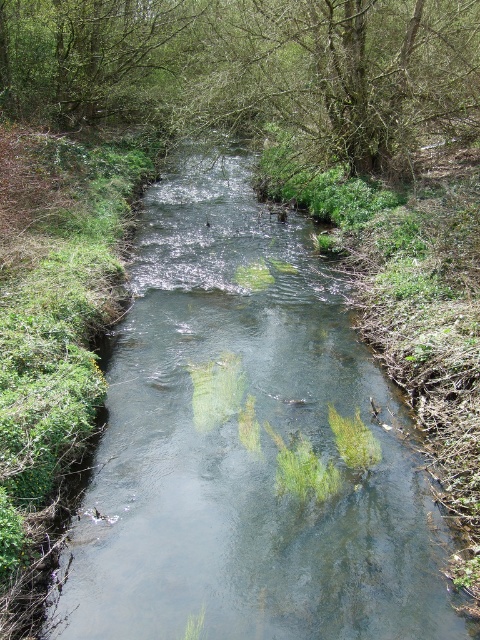
Question: Does green leafy tree at center have a greater width compared to green leafy tree at upper left?

Choices:
 (A) no
 (B) yes

Answer: (B)

Question: Estimate the real-world distances between objects in this image. Which object is farther from the green leafy tree at upper left?

Choices:
 (A) green leafy tree at center
 (B) clear water stream at center

Answer: (B)

Question: Which point is farther to the camera?

Choices:
 (A) clear water stream at center
 (B) green leafy tree at center

Answer: (B)

Question: Does clear water stream at center appear over green leafy tree at center?

Choices:
 (A) no
 (B) yes

Answer: (A)

Question: Estimate the real-world distances between objects in this image. Which object is farther from the green leafy tree at center?

Choices:
 (A) green leafy tree at upper left
 (B) clear water stream at center

Answer: (B)

Question: Can you confirm if clear water stream at center is smaller than green leafy tree at upper left?

Choices:
 (A) no
 (B) yes

Answer: (B)